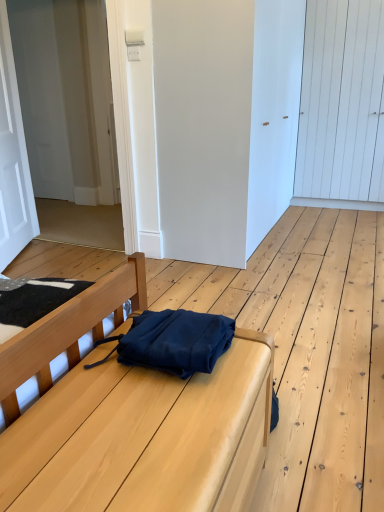
Question: From the image's perspective, is white matte door at center, which is the third door in left-to-right order, positioned above or below white matte door at left, the first door when ordered from left to right?

Choices:
 (A) above
 (B) below

Answer: (A)

Question: In the image, is white matte door at center, the second door viewed from the right, on the left side or the right side of white matte door at left, the first door when ordered from left to right?

Choices:
 (A) left
 (B) right

Answer: (B)

Question: Considering the real-world distances, which object is farthest from the white wooden door at upper right, acting as the fourth door starting from the left?

Choices:
 (A) navy blue fabric at center
 (B) white matte door at center, the second door viewed from the right
 (C) white matte door at left, the first door when ordered from left to right
 (D) navy blue fabric messenger bag at center
 (E) white matte door at upper left, which is counted as the second door, starting from the left

Answer: (A)

Question: Which object is positioned farthest from the white matte door at upper left, the 3th door viewed from the right?

Choices:
 (A) white matte door at left, the first door when ordered from left to right
 (B) white matte door at center, which is the third door in left-to-right order
 (C) navy blue fabric messenger bag at center
 (D) white wooden door at upper right, acting as the fourth door starting from the left
 (E) navy blue fabric at center

Answer: (E)